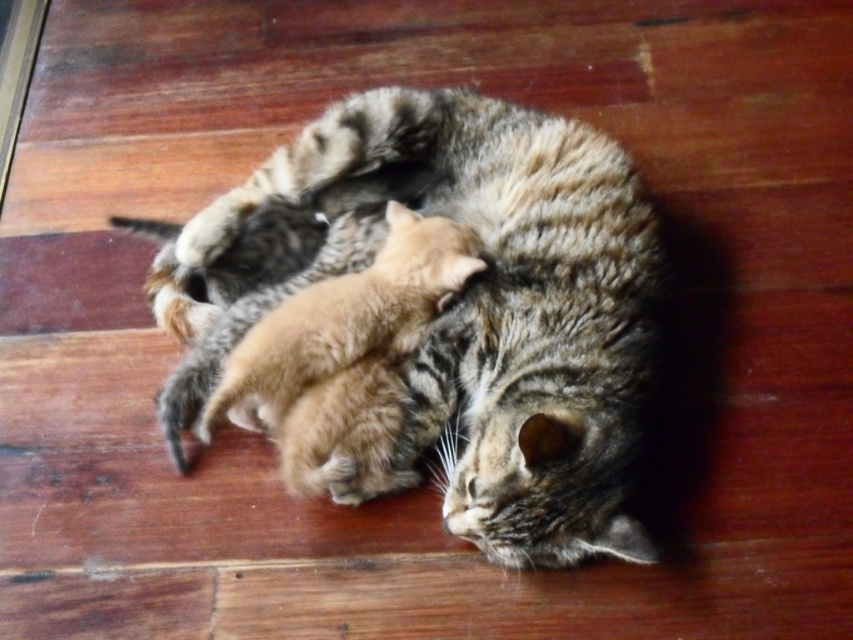
You are a photographer taking a picture of the mother cat and her kittens. You want to ensure that both the point at (x=494, y=243) and the point at (x=248, y=397) are in focus. Which point should you focus on first to ensure the other is also in focus?

Since point (x=494, y=243) is behind point (x=248, y=397), you should focus on point (x=248, y=397) first. This way, the depth of field will likely include the point behind it as well.

You are a veterinarian examining the image. You need to determine if the tabby fur cat at center can comfortably lie on a 20 cm wide pet bed while also accommodating the orange fur kitten at center. Based on their sizes, is this possible?

The tabby fur cat at center might be wider than the orange fur kitten at center. If the taby fur cat is wider than 20 cm, then they cannot both fit comfortably on the bed. However, if the tabby fur cat is narrower than 20 cm, there might be enough space for both. Without exact measurements, it is uncertain.